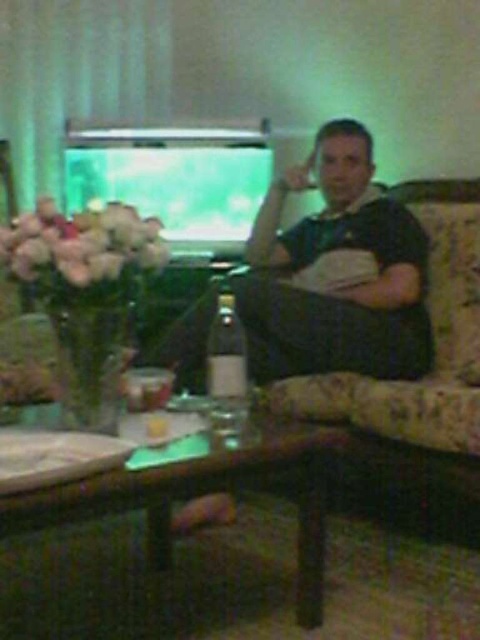
Question: Is dark green jersey at center smaller than floral-patterned fabric couch at right?

Choices:
 (A) yes
 (B) no

Answer: (A)

Question: Which point appears farthest from the camera in this image?

Choices:
 (A) (393, 509)
 (B) (289, 362)

Answer: (A)

Question: Can you confirm if dark green jersey at center is thinner than floral-patterned fabric couch at right?

Choices:
 (A) no
 (B) yes

Answer: (B)

Question: Among these points, which one is nearest to the camera?

Choices:
 (A) (326, 225)
 (B) (452, 406)

Answer: (B)

Question: Does dark green jersey at center come in front of floral-patterned fabric couch at right?

Choices:
 (A) yes
 (B) no

Answer: (B)

Question: Among these points, which one is farthest from the camera?

Choices:
 (A) (408, 310)
 (B) (406, 188)

Answer: (B)